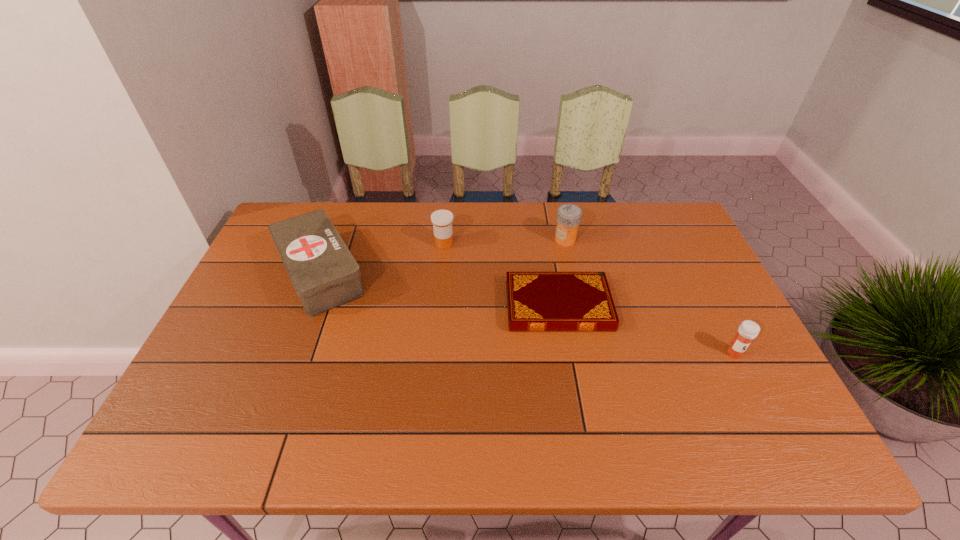
Find the location of `vacant space located 0.210m on the front of the leftmost object`. vacant space located 0.210m on the front of the leftmost object is located at coordinates (277, 387).

Find the location of a particular element. Image resolution: width=960 pixels, height=540 pixels. vacant area situated 0.190m on the label side of the nearest object is located at coordinates (775, 433).

Find the location of a particular element. This screenshot has width=960, height=540. free spot located on the cover of the hardback book is located at coordinates (405, 306).

Where is `vacant region located on the cover of the hardback book`? vacant region located on the cover of the hardback book is located at coordinates (427, 306).

Identify the location of free location located on the cover of the hardback book. This screenshot has width=960, height=540. (413, 306).

Locate an element on the screen. This screenshot has width=960, height=540. the first-aid kit at the far edge is located at coordinates pyautogui.click(x=325, y=275).

In order to click on object at the left edge in this screenshot , I will do `click(325, 275)`.

This screenshot has height=540, width=960. What are the coordinates of `object located in the right edge section of the desktop` in the screenshot? It's located at click(x=748, y=330).

Identify the location of object that is at the far left corner. Image resolution: width=960 pixels, height=540 pixels. (325, 275).

Locate an element on the screen. The height and width of the screenshot is (540, 960). vacant area at the far edge is located at coordinates [x=408, y=237].